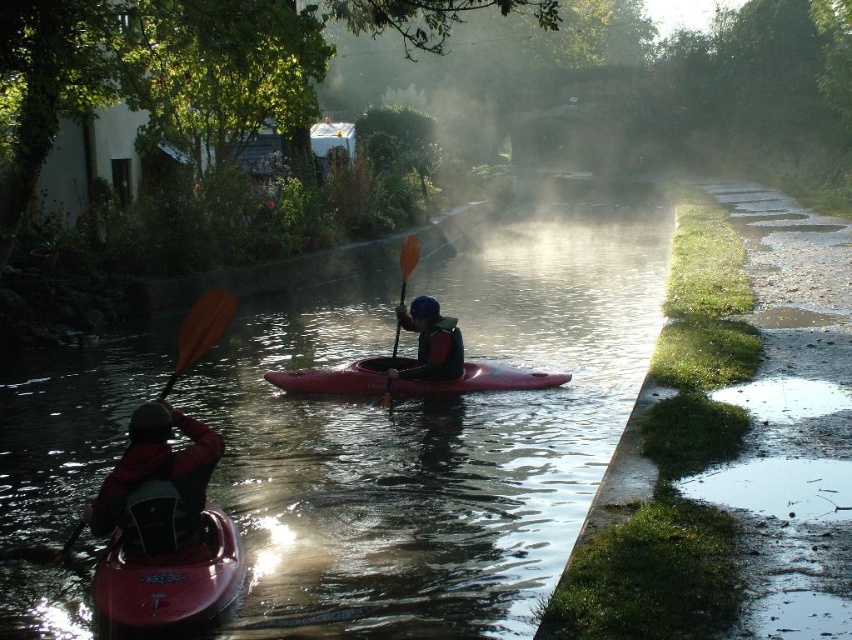
Can you confirm if matte red kayak at center is taller than orange paddle at left?

In fact, matte red kayak at center may be shorter than orange paddle at left.

Who is positioned more to the right, matte red kayak at center or orange paddle at left?

matte red kayak at center is more to the right.

Locate an element on the screen. The height and width of the screenshot is (640, 852). matte red kayak at center is located at coordinates (407, 380).

Can you confirm if matte black kayak at center is bigger than orange paddle at left?

No.

Looking at this image, which of these two, matte black kayak at center or orange paddle at left, stands shorter?

With less height is matte black kayak at center.

Which is in front, point (440, 353) or point (222, 296)?

Point (440, 353)

Locate an element on the screen. The image size is (852, 640). matte black kayak at center is located at coordinates (430, 342).

Is orange paddle at left thinner than orange paddle at center?

No, orange paddle at left is not thinner than orange paddle at center.

Who is more forward, (197,304) or (407,273)?

Point (407,273) is more forward.

Between point (206, 308) and point (404, 284), which one is positioned in front?

Point (206, 308)

At what (x,y) coordinates should I click in order to perform the action: click on orange paddle at left. Please return your answer as a coordinate pair (x, y). The height and width of the screenshot is (640, 852). Looking at the image, I should click on (200, 330).